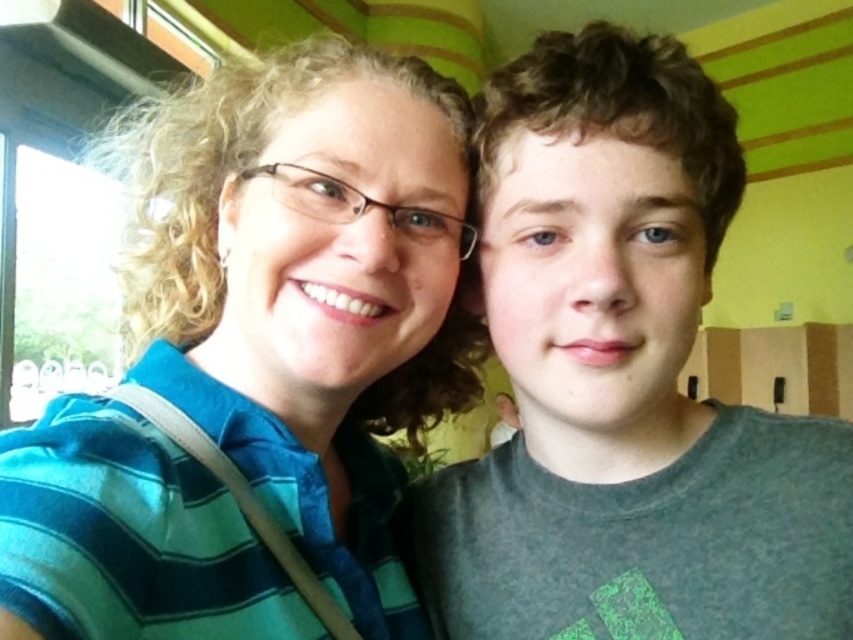
Does blue striped shirt at upper left appear on the left side of matte gray shirt at right?

Indeed, blue striped shirt at upper left is positioned on the left side of matte gray shirt at right.

Which is more to the right, blue striped shirt at upper left or matte gray shirt at right?

matte gray shirt at right is more to the right.

Where is `blue striped shirt at upper left`? Image resolution: width=853 pixels, height=640 pixels. blue striped shirt at upper left is located at coordinates (306, 289).